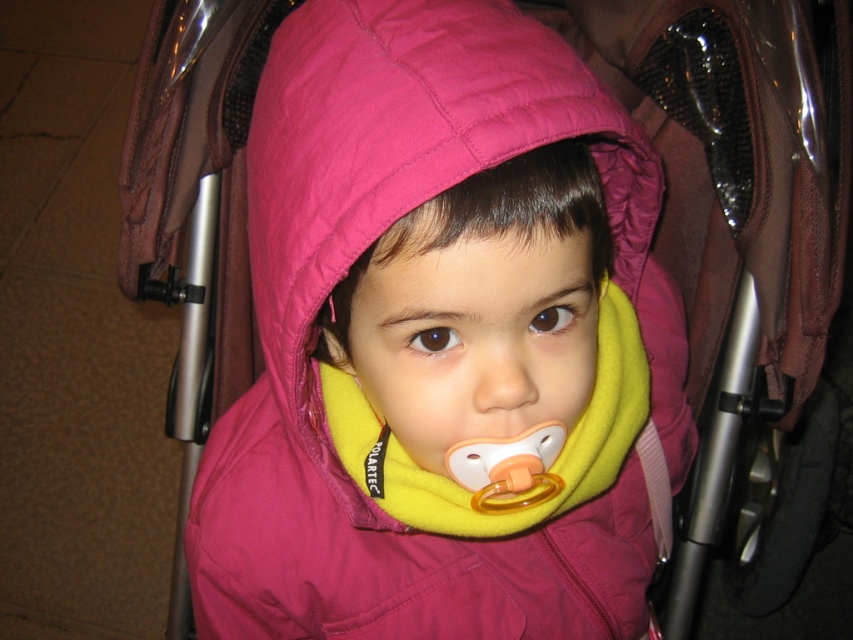
Question: Can you confirm if pink fleece jacket at center is wider than yellow rubber teething ring at center?

Choices:
 (A) no
 (B) yes

Answer: (B)

Question: Can you confirm if pink fleece jacket at center is positioned below yellow rubber teething ring at center?

Choices:
 (A) no
 (B) yes

Answer: (A)

Question: Which of the following is the closest to the observer?

Choices:
 (A) (479, 493)
 (B) (448, 362)

Answer: (B)

Question: Among these points, which one is nearest to the camera?

Choices:
 (A) (550, 496)
 (B) (392, 513)

Answer: (A)

Question: Among these points, which one is farthest from the camera?

Choices:
 (A) (511, 412)
 (B) (517, 486)

Answer: (B)

Question: Does pink fleece jacket at center have a larger size compared to yellow rubber teething ring at center?

Choices:
 (A) yes
 (B) no

Answer: (A)